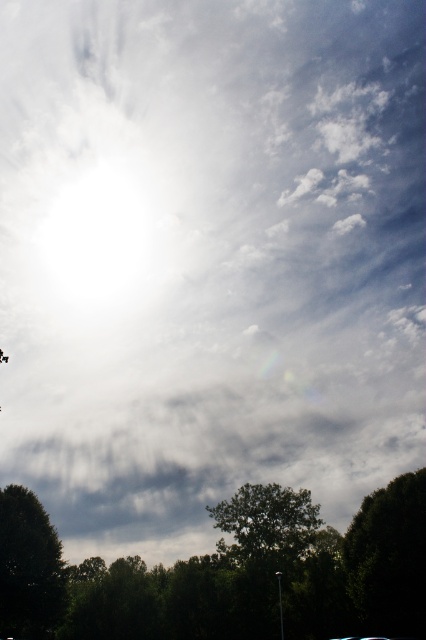
What are the coordinates of `dark green leafy tree at lower right` in the screenshot? It's located at (389, 557).

The width and height of the screenshot is (426, 640). What are the coordinates of `dark green leafy tree at lower right` in the screenshot? It's located at (389, 557).

Where is `dark green leafy tree at lower right`? dark green leafy tree at lower right is located at coordinates (389, 557).